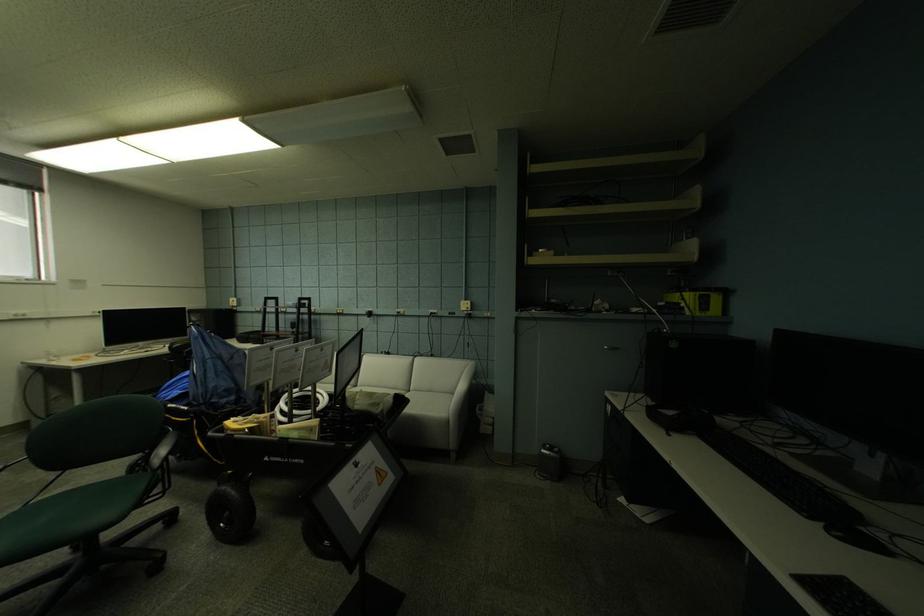
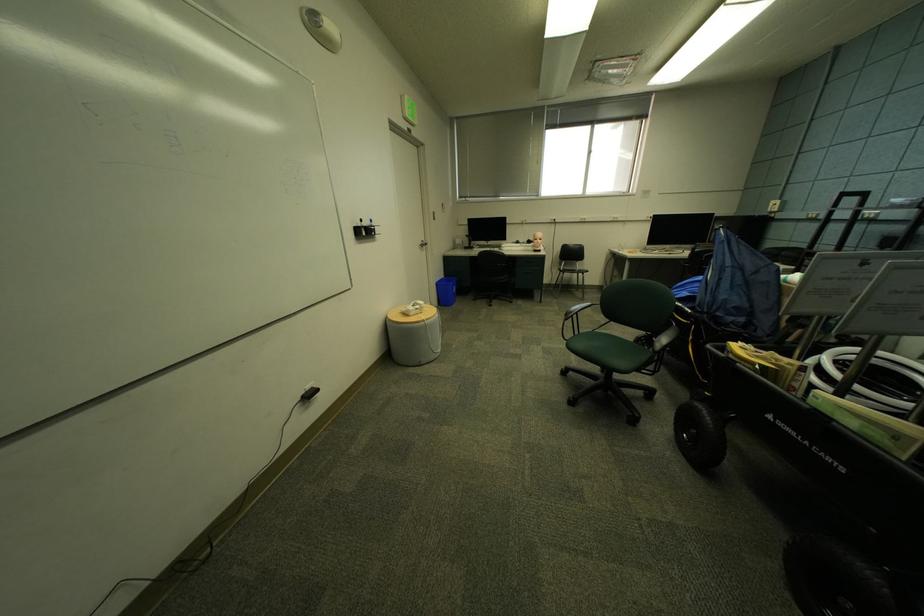
In the second image, find the point that corresponds to point 276,414 in the first image.

(807, 362)